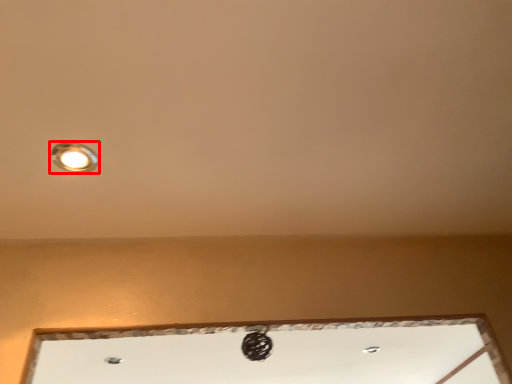
Question: Considering the relative positions of lamp (annotated by the red box) and window in the image provided, where is lamp (annotated by the red box) located with respect to the staircase?

Choices:
 (A) right
 (B) left

Answer: (B)